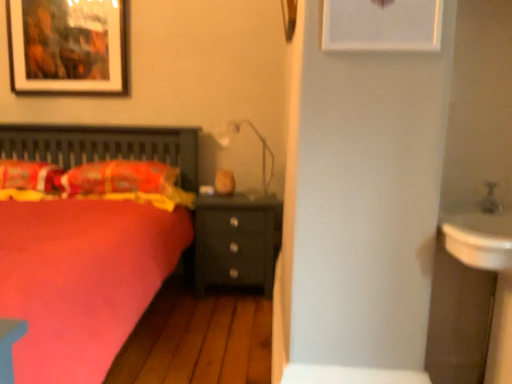
Question: Is fluffy orange pillow at left, which is counted as the first pillow, starting from the left, surrounded by matte white lamp at center?

Choices:
 (A) yes
 (B) no

Answer: (B)

Question: From the image's perspective, is matte white lamp at center over fluffy orange pillow at left, which is the second pillow in right-to-left order?

Choices:
 (A) no
 (B) yes

Answer: (B)

Question: Does matte white lamp at center come behind fluffy orange pillow at left, which is the second pillow in right-to-left order?

Choices:
 (A) yes
 (B) no

Answer: (A)

Question: From the image's perspective, would you say matte white lamp at center is shown under fluffy orange pillow at left, which is counted as the first pillow, starting from the left?

Choices:
 (A) yes
 (B) no

Answer: (B)

Question: Does matte white lamp at center have a lesser height compared to fluffy orange pillow at left, which is the second pillow in right-to-left order?

Choices:
 (A) no
 (B) yes

Answer: (A)

Question: Considering the positions of point (272, 160) and point (244, 226), is point (272, 160) closer or farther from the camera than point (244, 226)?

Choices:
 (A) farther
 (B) closer

Answer: (A)

Question: From the image's perspective, is matte white lamp at center above or below matte black nightstand at center?

Choices:
 (A) above
 (B) below

Answer: (A)

Question: Would you say matte white lamp at center is inside or outside matte black nightstand at center?

Choices:
 (A) inside
 (B) outside

Answer: (B)

Question: Considering the positions of matte white lamp at center and matte black nightstand at center in the image, is matte white lamp at center wider or thinner than matte black nightstand at center?

Choices:
 (A) wide
 (B) thin

Answer: (B)

Question: Is matte white lamp at center to the left or to the right of white matte picture frame at upper center, the 2th picture frame when ordered from back to front, in the image?

Choices:
 (A) left
 (B) right

Answer: (A)

Question: Is matte white lamp at center inside the boundaries of white matte picture frame at upper center, which is the 2th picture frame from left to right, or outside?

Choices:
 (A) outside
 (B) inside

Answer: (A)

Question: From a real-world perspective, is matte white lamp at center positioned above or below white matte picture frame at upper center, the 2th picture frame when ordered from back to front?

Choices:
 (A) above
 (B) below

Answer: (B)

Question: Does point (268, 150) appear closer or farther from the camera than point (324, 41)?

Choices:
 (A) farther
 (B) closer

Answer: (A)

Question: From a real-world perspective, is matte black picture frame at upper left, which appears as the second picture frame when viewed from the front, physically located above or below fluffy orange pillow at left, which is the second pillow in right-to-left order?

Choices:
 (A) below
 (B) above

Answer: (B)

Question: Considering their positions, is matte black picture frame at upper left, which appears as the second picture frame when viewed from the front, located in front of or behind fluffy orange pillow at left, which is the second pillow in right-to-left order?

Choices:
 (A) behind
 (B) front

Answer: (A)